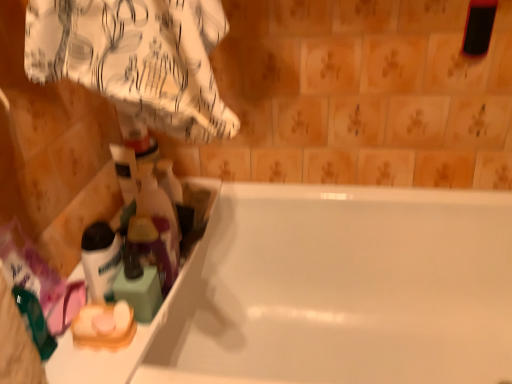
What do you see at coordinates (345, 290) in the screenshot? The height and width of the screenshot is (384, 512). I see `white glossy bathtub at center` at bounding box center [345, 290].

Measure the distance between white glossy bathtub at center and camera.

white glossy bathtub at center is 3.55 feet from camera.

Where is `white glossy bathtub at center`? This screenshot has height=384, width=512. white glossy bathtub at center is located at coordinates (345, 290).

Identify the location of white glossy bathtub at center. The width and height of the screenshot is (512, 384). (345, 290).